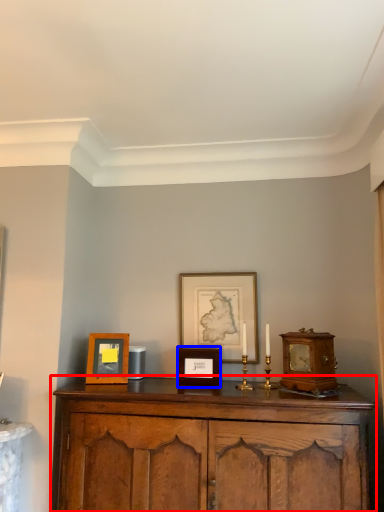
Question: Among these objects, which one is farthest to the camera, cabinetry (highlighted by a red box) or picture frame (highlighted by a blue box)?

Choices:
 (A) cabinetry
 (B) picture frame

Answer: (B)